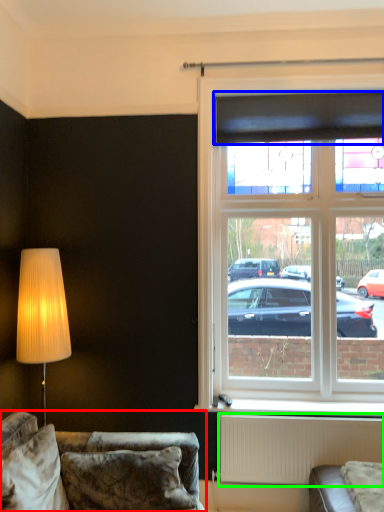
Question: Which is farther away from studio couch (highlighted by a red box)? curtain (highlighted by a blue box) or radiator (highlighted by a green box)?

Choices:
 (A) curtain
 (B) radiator

Answer: (A)